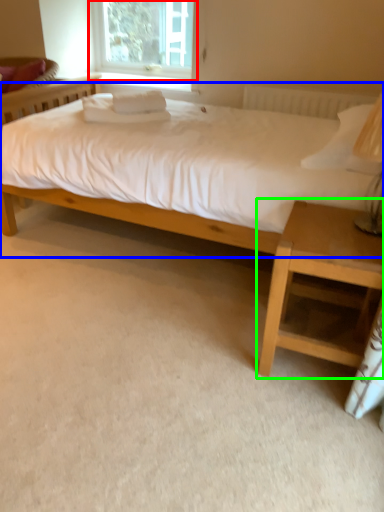
Question: Based on their relative distances, which object is farther from window (highlighted by a red box)? Choose from bed (highlighted by a blue box) and nightstand (highlighted by a green box).

Choices:
 (A) bed
 (B) nightstand

Answer: (B)